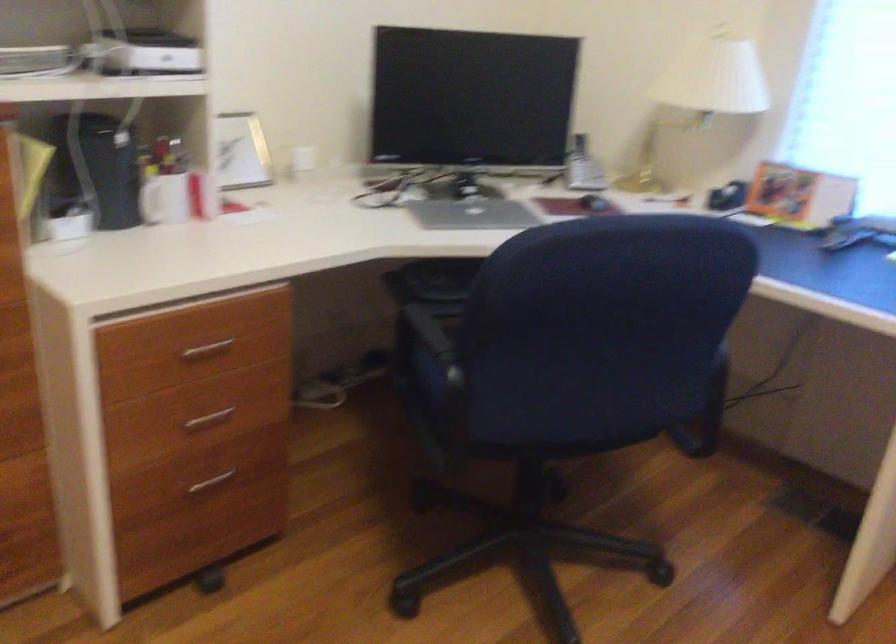
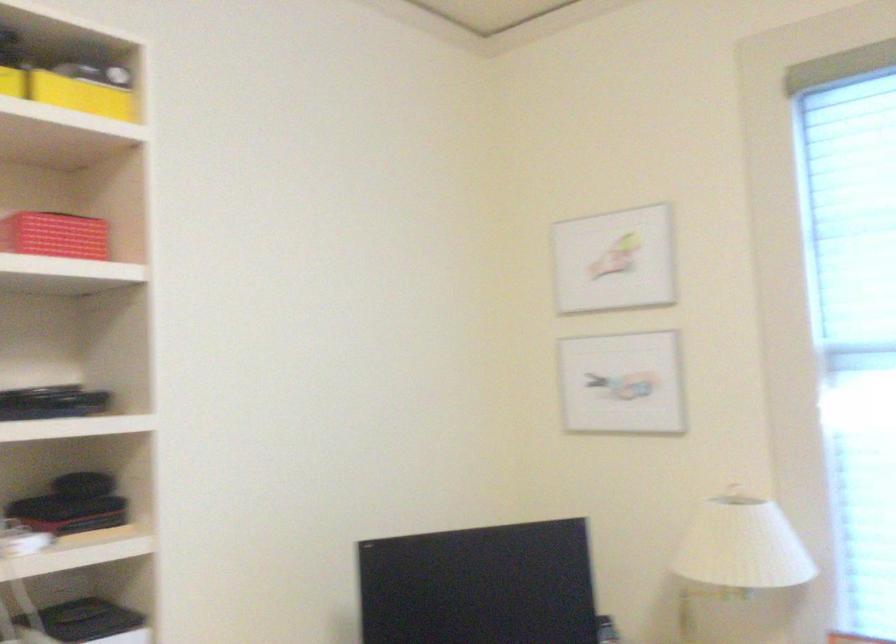
Question: The images are taken continuously from a first-person perspective. In which direction are you moving?

Choices:
 (A) Left
 (B) Right
 (C) Forward
 (D) Backward

Answer: (C)